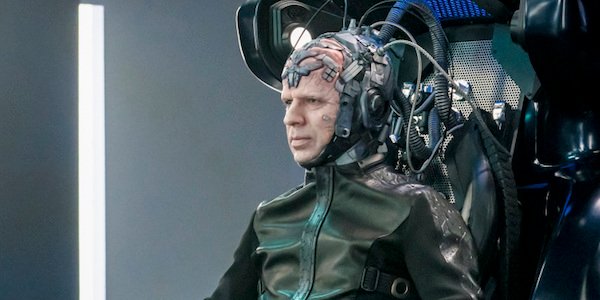
Identify the location of light grey wall. (148, 117).